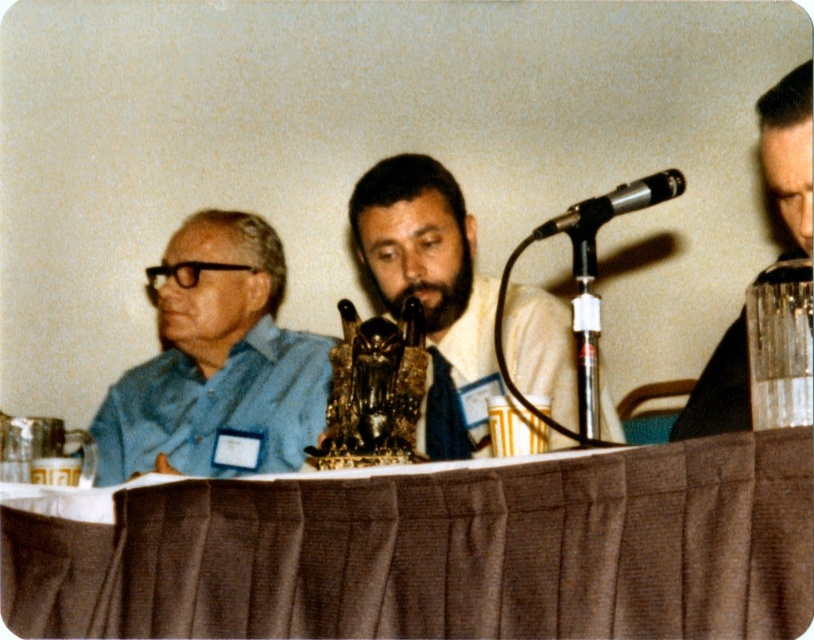
Question: Which point is closer to the camera?

Choices:
 (A) pyautogui.click(x=471, y=275)
 (B) pyautogui.click(x=400, y=307)
 (C) pyautogui.click(x=254, y=307)

Answer: (B)

Question: Where is brown fabric table at center located in relation to matte gold statue at center in the image?

Choices:
 (A) left
 (B) right

Answer: (A)

Question: Can you confirm if brown fabric table at center is positioned to the left of matte gold statue at center?

Choices:
 (A) no
 (B) yes

Answer: (B)

Question: Which object is positioned closest to the clear plastic glass at right?

Choices:
 (A) blue matte shirt at left
 (B) black plastic microphone at center
 (C) brown fabric table at center
 (D) matte gold statue at center

Answer: (B)

Question: Observing the image, what is the correct spatial positioning of brown fabric table at center in reference to black metallic microphone at upper right?

Choices:
 (A) below
 (B) above

Answer: (A)

Question: Based on their relative distances, which object is nearer to the black metallic microphone at upper right?

Choices:
 (A) black plastic microphone at center
 (B) clear plastic glass at right

Answer: (B)